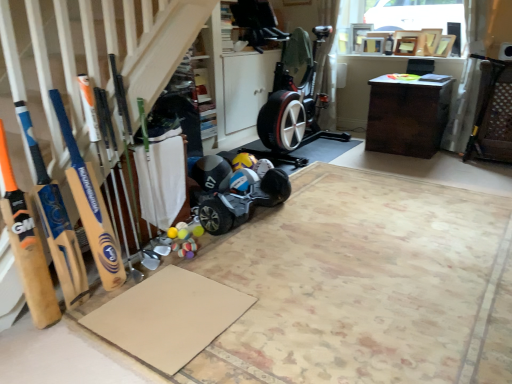
What is the approximate width of brown cardboard yoga mat at lower left, the 1th yoga mat positioned from the back?

brown cardboard yoga mat at lower left, the 1th yoga mat positioned from the back, is 20.17 inches in width.

What is the approximate width of matte black helmet at center?

matte black helmet at center is 23.85 centimeters in width.

Identify the location of black rubber baby carriage at center. The height and width of the screenshot is (384, 512). (236, 189).

What do you see at coordinates (236, 189) in the screenshot? Image resolution: width=512 pixels, height=384 pixels. I see `black rubber baby carriage at center` at bounding box center [236, 189].

Image resolution: width=512 pixels, height=384 pixels. Describe the element at coordinates (364, 285) in the screenshot. I see `beige cardboard at lower left, marked as the 2th yoga mat in a back-to-front arrangement` at that location.

The height and width of the screenshot is (384, 512). I want to click on wooden bat at left, arranged as the 1th baseball bat when viewed from the left, so click(27, 245).

Find the location of a particular element. Image resolution: width=512 pixels, height=384 pixels. brown cardboard yoga mat at lower left, the 1th yoga mat positioned from the back is located at coordinates (168, 317).

Which object is positioned more to the left, matte black helmet at center or black rubber baby carriage at center?

Positioned to the left is matte black helmet at center.

Considering the relative sizes of matte black helmet at center and black rubber baby carriage at center in the image provided, is matte black helmet at center taller than black rubber baby carriage at center?

No.

Is matte black helmet at center positioned beyond the bounds of black rubber baby carriage at center?

That's correct, matte black helmet at center is outside of black rubber baby carriage at center.

Considering the relative positions of dark brown wooden desk at center and wooden bat at left, placed as the first baseball bat when sorted from right to left, in the image provided, is dark brown wooden desk at center to the left of wooden bat at left, placed as the first baseball bat when sorted from right to left, from the viewer's perspective?

No.

Image resolution: width=512 pixels, height=384 pixels. What are the coordinates of `desk on the right side of wooden bat at left, which is counted as the second baseball bat, starting from the left` in the screenshot? It's located at (407, 116).

Which is nearer, [432,155] or [83,204]?

Point [432,155] appears to be farther away from the viewer than point [83,204].

Considering the relative sizes of dark brown wooden desk at center and wooden bat at left, placed as the first baseball bat when sorted from right to left, in the image provided, is dark brown wooden desk at center shorter than wooden bat at left, placed as the first baseball bat when sorted from right to left,?

Correct, dark brown wooden desk at center is not as tall as wooden bat at left, placed as the first baseball bat when sorted from right to left.

Is point (216, 285) farther from camera compared to point (79, 187)?

That is True.

From the image's perspective, would you say brown cardboard yoga mat at lower left, the 1th yoga mat positioned from the back, is positioned over wooden bat at left, which is counted as the second baseball bat, starting from the left?

No.

Is brown cardboard yoga mat at lower left, the 1th yoga mat positioned from the back, positioned beyond the bounds of wooden bat at left, placed as the first baseball bat when sorted from right to left?

That's correct, brown cardboard yoga mat at lower left, the 1th yoga mat positioned from the back, is outside of wooden bat at left, placed as the first baseball bat when sorted from right to left.

Is brown cardboard yoga mat at lower left, the 1th yoga mat positioned from the back, in contact with wooden bat at left, which is counted as the second baseball bat, starting from the left?

No, brown cardboard yoga mat at lower left, the 1th yoga mat positioned from the back, is not with wooden bat at left, which is counted as the second baseball bat, starting from the left.

Find the location of a particular element. The height and width of the screenshot is (384, 512). baby carriage located on the right of brown cardboard yoga mat at lower left, acting as the second yoga mat starting from the front is located at coordinates (236, 189).

Considering the relative positions of brown cardboard yoga mat at lower left, acting as the second yoga mat starting from the front, and black rubber baby carriage at center in the image provided, is brown cardboard yoga mat at lower left, acting as the second yoga mat starting from the front, to the right of black rubber baby carriage at center from the viewer's perspective?

In fact, brown cardboard yoga mat at lower left, acting as the second yoga mat starting from the front, is to the left of black rubber baby carriage at center.

Between point (121, 301) and point (221, 231), which one is positioned in front?

The point (121, 301) is closer.

Considering the sizes of brown cardboard yoga mat at lower left, acting as the second yoga mat starting from the front, and black rubber baby carriage at center in the image, is brown cardboard yoga mat at lower left, acting as the second yoga mat starting from the front, bigger or smaller than black rubber baby carriage at center?

Considering their sizes, brown cardboard yoga mat at lower left, acting as the second yoga mat starting from the front, takes up less space than black rubber baby carriage at center.

Is wooden bat at left, which is counted as the second baseball bat, starting from the left, to the left of dark brown wooden desk at center from the viewer's perspective?

Yes, wooden bat at left, which is counted as the second baseball bat, starting from the left, is to the left of dark brown wooden desk at center.

Could you tell me if wooden bat at left, which is counted as the second baseball bat, starting from the left, is facing dark brown wooden desk at center?

No, wooden bat at left, which is counted as the second baseball bat, starting from the left, is not aimed at dark brown wooden desk at center.

Based on the photo, considering the relative sizes of wooden bat at left, placed as the first baseball bat when sorted from right to left, and dark brown wooden desk at center in the image provided, is wooden bat at left, placed as the first baseball bat when sorted from right to left, shorter than dark brown wooden desk at center?

No.

Considering the relative sizes of beige cardboard at lower left, marked as the 2th yoga mat in a back-to-front arrangement, and dark brown wooden desk at center in the image provided, is beige cardboard at lower left, marked as the 2th yoga mat in a back-to-front arrangement, shorter than dark brown wooden desk at center?

Correct, beige cardboard at lower left, marked as the 2th yoga mat in a back-to-front arrangement, is not as tall as dark brown wooden desk at center.

Does point (415, 316) lie in front of point (401, 152)?

Yes, it is.

Do you think beige cardboard at lower left, the 1th yoga mat positioned from the front, is within dark brown wooden desk at center, or outside of it?

beige cardboard at lower left, the 1th yoga mat positioned from the front, is outside dark brown wooden desk at center.

Is beige cardboard at lower left, marked as the 2th yoga mat in a back-to-front arrangement, positioned behind dark brown wooden desk at center?

No, it is in front of dark brown wooden desk at center.

Image resolution: width=512 pixels, height=384 pixels. Identify the location of sports equipment above the beige cardboard at lower left, the 1th yoga mat positioned from the front (from a real-world perspective). (212, 173).

From the image's perspective, is beige cardboard at lower left, the 1th yoga mat positioned from the front, located beneath matte black helmet at center?

Yes, from the image's perspective, beige cardboard at lower left, the 1th yoga mat positioned from the front, is below matte black helmet at center.

Who is bigger, beige cardboard at lower left, the 1th yoga mat positioned from the front, or matte black helmet at center?

beige cardboard at lower left, the 1th yoga mat positioned from the front.

Can you confirm if beige cardboard at lower left, the 1th yoga mat positioned from the front, is shorter than matte black helmet at center?

Indeed, beige cardboard at lower left, the 1th yoga mat positioned from the front, has a lesser height compared to matte black helmet at center.

Identify the location of sports equipment that appears behind the black rubber baby carriage at center. Image resolution: width=512 pixels, height=384 pixels. (212, 173).

Starting from the dark brown wooden desk at center, which baseball bat is the 1st one in front? Please provide its 2D coordinates.

[(90, 206)]

Based on their spatial positions, is wooden bat at left, which is the second baseball bat from right to left, or black rubber baby carriage at center further from wooden bat at left, which is counted as the second baseball bat, starting from the left?

black rubber baby carriage at center lies further to wooden bat at left, which is counted as the second baseball bat, starting from the left, than the other object.

Estimate the real-world distances between objects in this image. Which object is closer to matte black helmet at center, dark brown wooden desk at center or black rubber baby carriage at center?

black rubber baby carriage at center is closer to matte black helmet at center.

Looking at the image, which one is located closer to matte black helmet at center, wooden bat at left, which is counted as the second baseball bat, starting from the left, or beige cardboard at lower left, marked as the 2th yoga mat in a back-to-front arrangement?

Based on the image, beige cardboard at lower left, marked as the 2th yoga mat in a back-to-front arrangement, appears to be nearer to matte black helmet at center.

Based on their spatial positions, is matte black helmet at center or dark brown wooden desk at center closer to wooden bat at left, which is counted as the second baseball bat, starting from the left?

Based on the image, matte black helmet at center appears to be nearer to wooden bat at left, which is counted as the second baseball bat, starting from the left.

Looking at the image, which one is located further to matte black helmet at center, black rubber baby carriage at center or wooden bat at left, placed as the first baseball bat when sorted from right to left?

wooden bat at left, placed as the first baseball bat when sorted from right to left.

Consider the image. Which object lies nearer to the anchor point brown cardboard yoga mat at lower left, the 1th yoga mat positioned from the back, wooden bat at left, which is counted as the second baseball bat, starting from the left, or beige cardboard at lower left, the 1th yoga mat positioned from the front?

Among the two, wooden bat at left, which is counted as the second baseball bat, starting from the left, is located nearer to brown cardboard yoga mat at lower left, the 1th yoga mat positioned from the back.

Considering their positions, is brown cardboard yoga mat at lower left, acting as the second yoga mat starting from the front, positioned further to wooden bat at left, which is the second baseball bat from right to left, than dark brown wooden desk at center?

dark brown wooden desk at center lies further to wooden bat at left, which is the second baseball bat from right to left, than the other object.

When comparing their distances from beige cardboard at lower left, marked as the 2th yoga mat in a back-to-front arrangement, does dark brown wooden desk at center or wooden bat at left, which is the second baseball bat from right to left, seem closer?

Based on the image, wooden bat at left, which is the second baseball bat from right to left, appears to be nearer to beige cardboard at lower left, marked as the 2th yoga mat in a back-to-front arrangement.

Image resolution: width=512 pixels, height=384 pixels. I want to click on baseball bat positioned between brown cardboard yoga mat at lower left, the 1th yoga mat positioned from the back, and dark brown wooden desk at center from near to far, so coord(90,206).

Where is `yoga mat between wooden bat at left, arranged as the 1th baseball bat when viewed from the left, and matte black helmet at center in the front-back direction`? Image resolution: width=512 pixels, height=384 pixels. yoga mat between wooden bat at left, arranged as the 1th baseball bat when viewed from the left, and matte black helmet at center in the front-back direction is located at coordinates (168, 317).

Identify the location of baseball bat between wooden bat at left, arranged as the 1th baseball bat when viewed from the left, and matte black helmet at center, along the z-axis. (90, 206).

The height and width of the screenshot is (384, 512). I want to click on baby carriage between beige cardboard at lower left, marked as the 2th yoga mat in a back-to-front arrangement, and matte black helmet at center in the front-back direction, so click(x=236, y=189).